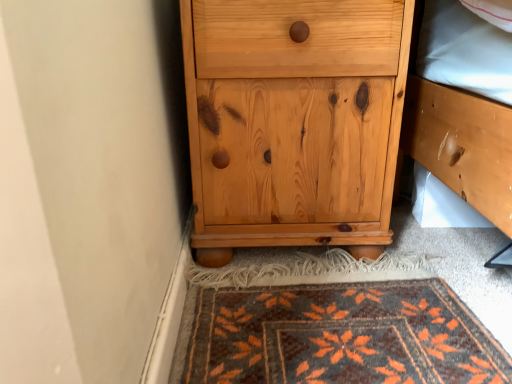
Question: Could you tell me if dark brown woven rug at lower center is turned towards natural wood chest of drawers at lower center?

Choices:
 (A) no
 (B) yes

Answer: (A)

Question: Are dark brown woven rug at lower center and natural wood chest of drawers at lower center located far from each other?

Choices:
 (A) no
 (B) yes

Answer: (A)

Question: Is dark brown woven rug at lower center to the left of natural wood chest of drawers at lower center from the viewer's perspective?

Choices:
 (A) yes
 (B) no

Answer: (B)

Question: Is dark brown woven rug at lower center at the right side of natural wood chest of drawers at lower center?

Choices:
 (A) yes
 (B) no

Answer: (A)

Question: Does dark brown woven rug at lower center have a larger size compared to natural wood chest of drawers at lower center?

Choices:
 (A) yes
 (B) no

Answer: (B)

Question: Is dark brown woven rug at lower center looking in the opposite direction of natural wood chest of drawers at lower center?

Choices:
 (A) yes
 (B) no

Answer: (B)

Question: Is natural wood chest of drawers at lower center aimed at dark brown woven rug at lower center?

Choices:
 (A) no
 (B) yes

Answer: (B)

Question: Can you confirm if natural wood chest of drawers at lower center is bigger than dark brown woven rug at lower center?

Choices:
 (A) no
 (B) yes

Answer: (B)

Question: Is natural wood chest of drawers at lower center in front of dark brown woven rug at lower center?

Choices:
 (A) yes
 (B) no

Answer: (B)

Question: From the image's perspective, is natural wood chest of drawers at lower center on top of dark brown woven rug at lower center?

Choices:
 (A) yes
 (B) no

Answer: (A)

Question: Does natural wood chest of drawers at lower center have a smaller size compared to dark brown woven rug at lower center?

Choices:
 (A) no
 (B) yes

Answer: (A)

Question: Is natural wood chest of drawers at lower center located outside dark brown woven rug at lower center?

Choices:
 (A) no
 (B) yes

Answer: (B)

Question: In terms of height, does natural wood chest of drawers at lower center look taller or shorter compared to dark brown woven rug at lower center?

Choices:
 (A) short
 (B) tall

Answer: (B)